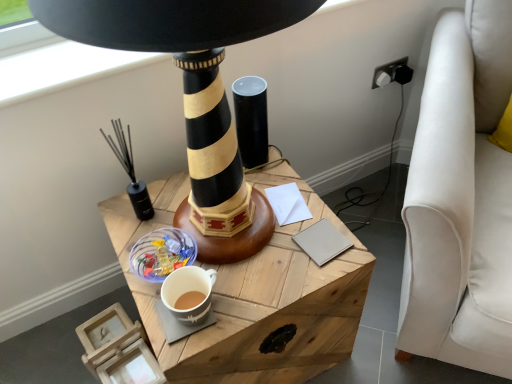
This screenshot has width=512, height=384. I want to click on free space to the back side of white paper at center, which is the 1th notepad from back to front, so click(x=276, y=174).